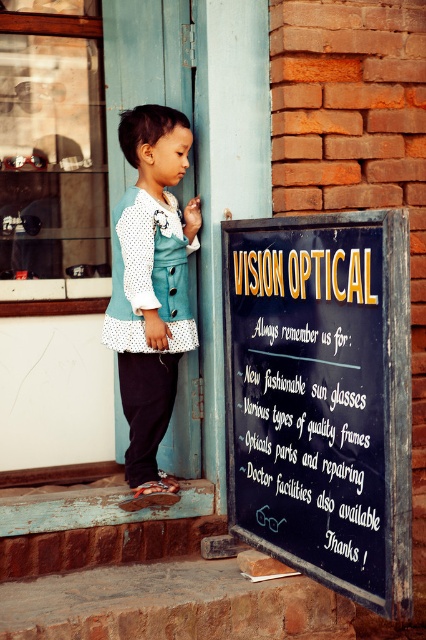
The child is looking at the shop entrance. Where is the white chalkboard at center located in relation to the child?

The white chalkboard at center is located at point [311,433] in 2D coordinates relative to the child.

You are a customer entering the shop and see the black chalkboard at center and the white chalkboard at center. You want to place a small decorative item between them. Is there enough space to fit it?

The black chalkboard at center and white chalkboard at center are 1.59 inches apart from each other, so there is enough space to place a small decorative item between them.